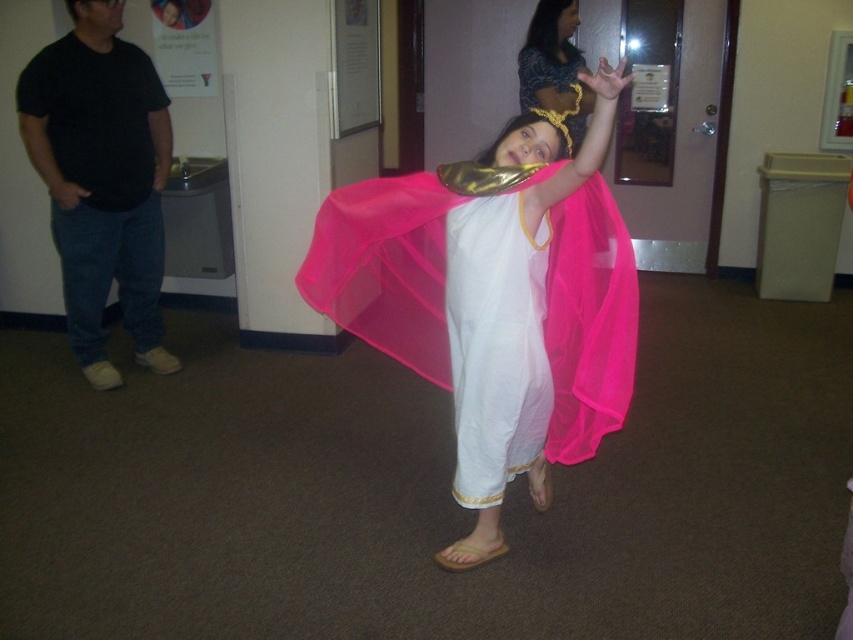
Identify the location of matte pink fabric at center. This screenshot has width=853, height=640. (495, 298).

Between point (404, 305) and point (474, 221), which one is positioned behind?

Point (404, 305)

At what (x,y) coordinates should I click in order to perform the action: click on matte pink fabric at center. Please return your answer as a coordinate pair (x, y). The width and height of the screenshot is (853, 640). Looking at the image, I should click on (495, 298).

Between matte black t-shirt at left and matte gold headband at upper center, which one appears on the right side from the viewer's perspective?

From the viewer's perspective, matte gold headband at upper center appears more on the right side.

Is point (141, 339) closer to camera compared to point (554, 40)?

Yes.

Locate an element on the screen. matte black t-shirt at left is located at coordinates (100, 180).

Does matte pink fabric at center have a greater width compared to matte gold headband at upper center?

Indeed, matte pink fabric at center has a greater width compared to matte gold headband at upper center.

Which is below, matte pink fabric at center or matte gold headband at upper center?

matte pink fabric at center

Identify the location of matte pink fabric at center. (495, 298).

Where is `matte pink fabric at center`? This screenshot has width=853, height=640. matte pink fabric at center is located at coordinates (495, 298).